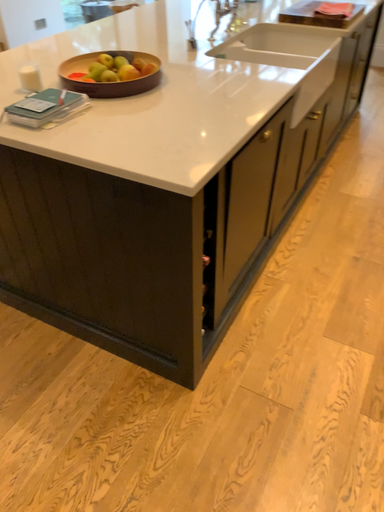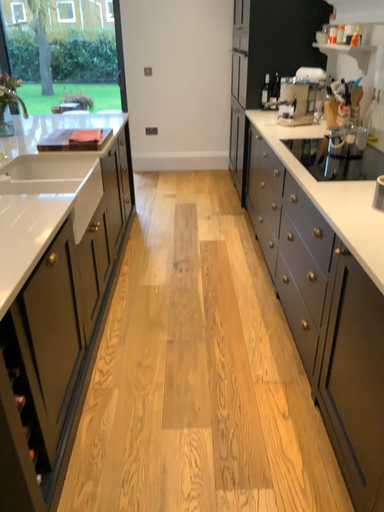
Question: Which way did the camera rotate in the video?

Choices:
 (A) rotated downward
 (B) rotated upward

Answer: (B)